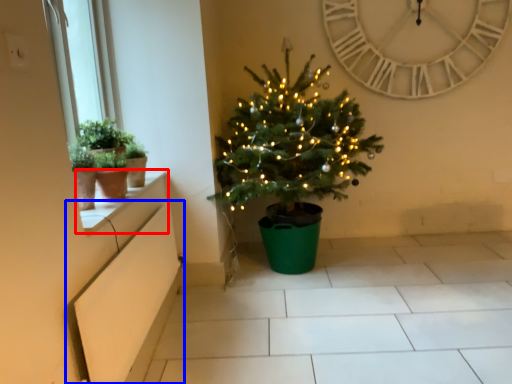
Question: Among these objects, which one is nearest to the camera, window sill (highlighted by a red box) or window box (highlighted by a blue box)?

Choices:
 (A) window sill
 (B) window box

Answer: (B)